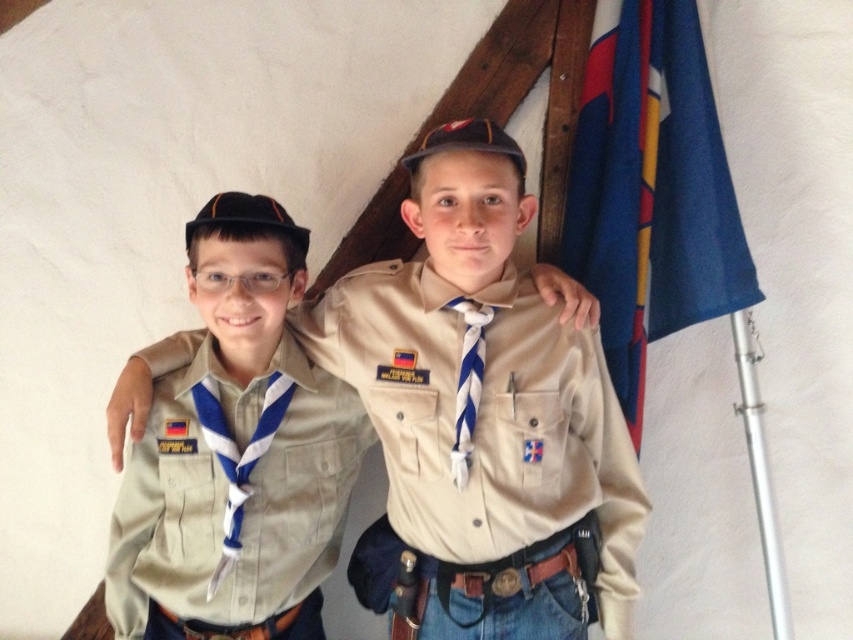
You are a scoutmaster trying to organize a group photo. You notice the tan fabric shirt at center and the blue fabric flag at upper right in the image. Which object is positioned to the left when viewed from the front?

The tan fabric shirt at center is positioned to the left of the blue fabric flag at upper right.

Looking at this image, you are a photographer setting up for a group photo. You notice the tan fabric uniform at center and the blue fabric flag at upper right. Which object is closer to the camera?

The tan fabric uniform at center is closer to the camera because it is in front of the blue fabric flag at upper right.